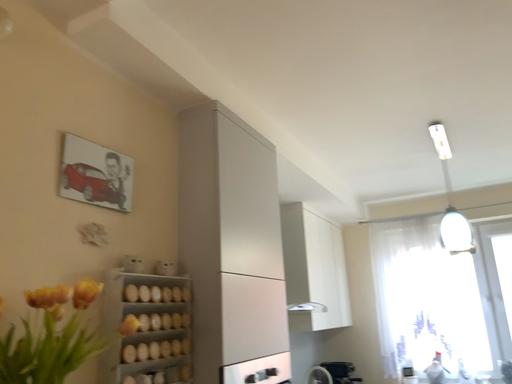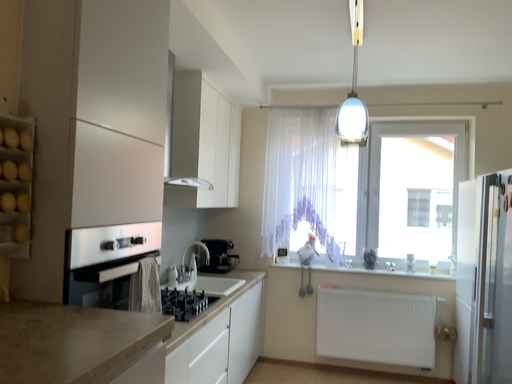
Question: How did the camera likely rotate when shooting the video?

Choices:
 (A) rotated right
 (B) rotated left

Answer: (A)